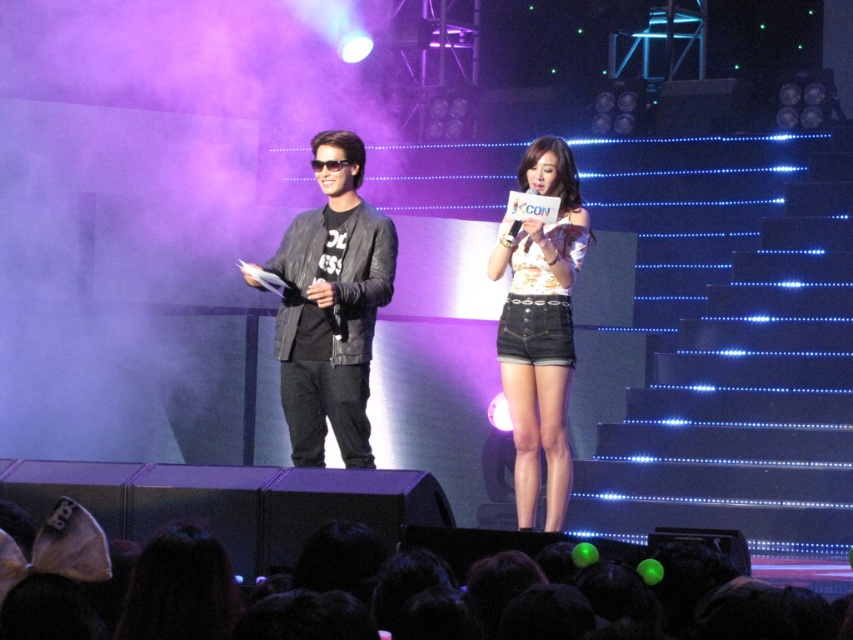
Based on the photo, who is lower down, leather jacket at center or floral fabric top at center?

floral fabric top at center

This screenshot has height=640, width=853. What do you see at coordinates (331, 307) in the screenshot?
I see `leather jacket at center` at bounding box center [331, 307].

Is point (311, 333) farther from viewer compared to point (567, 214)?

No.

Locate an element on the screen. The width and height of the screenshot is (853, 640). leather jacket at center is located at coordinates (331, 307).

Who is more distant from viewer, (9,630) or (321,448)?

→ Point (321,448)

Between point (328, 618) and point (302, 355), which one is positioned in front?

Positioned in front is point (328, 618).

What do you see at coordinates (225, 600) in the screenshot? The image size is (853, 640). I see `denim shorts at center` at bounding box center [225, 600].

You are a GUI agent. You are given a task and a screenshot of the screen. Output one action in this format:
    pyautogui.click(x=<x>, y=<y>)
    Task: Click on the denim shorts at center
    
    Given the screenshot: What is the action you would take?
    pyautogui.click(x=225, y=600)

Is denim shorts at center bigger than floral fabric top at center?

Actually, denim shorts at center might be smaller than floral fabric top at center.

Which is behind, point (718, 592) or point (549, 492)?

The point (549, 492) is behind.

Describe the element at coordinates (225, 600) in the screenshot. The width and height of the screenshot is (853, 640). I see `denim shorts at center` at that location.

The image size is (853, 640). Identify the location of denim shorts at center. (225, 600).